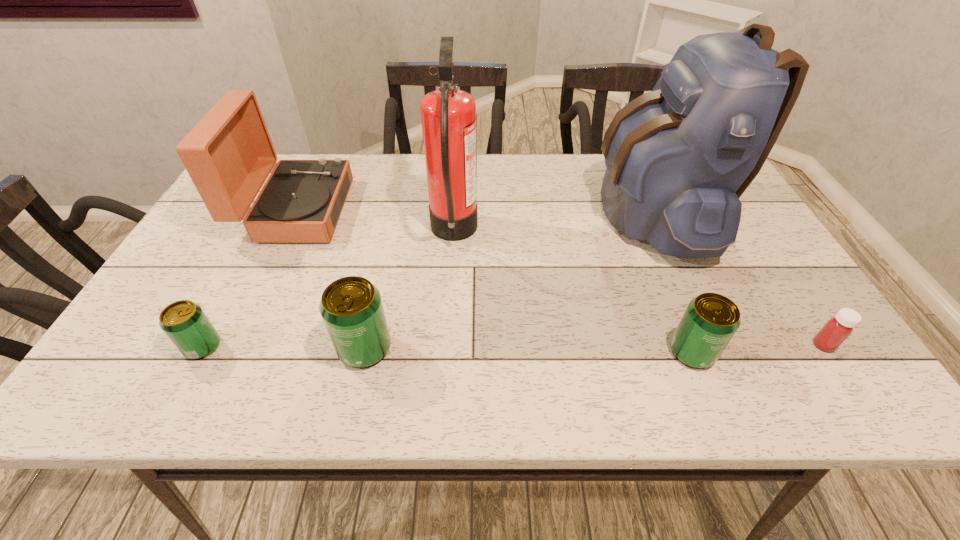
I want to click on medicine present at the near edge, so click(837, 329).

Image resolution: width=960 pixels, height=540 pixels. I want to click on beer can present at the left edge, so click(x=184, y=322).

At what (x,y) coordinates should I click in order to perform the action: click on phonograph record that is at the left edge. Please return your answer as a coordinate pair (x, y). This screenshot has height=540, width=960. Looking at the image, I should click on (229, 154).

At what (x,y) coordinates should I click in order to perform the action: click on backpack that is at the right edge. Please return your answer as a coordinate pair (x, y). Image resolution: width=960 pixels, height=540 pixels. Looking at the image, I should click on (678, 158).

Image resolution: width=960 pixels, height=540 pixels. Find the location of `medicine present at the right edge`. medicine present at the right edge is located at coordinates (837, 329).

Where is `object that is at the far left corner`? This screenshot has height=540, width=960. object that is at the far left corner is located at coordinates pyautogui.click(x=229, y=154).

Where is `object that is at the near left corner`? object that is at the near left corner is located at coordinates (184, 322).

Find the location of a particular element. This screenshot has height=540, width=960. object that is at the far right corner is located at coordinates click(678, 158).

You are a GUI agent. You are given a task and a screenshot of the screen. Output one action in this format:
    pyautogui.click(x=<x>, y=<y>)
    Task: Click on the object located at the near right corner
    
    Given the screenshot: What is the action you would take?
    pyautogui.click(x=837, y=329)

Find the location of a particular element. vacant point at the far edge is located at coordinates (540, 178).